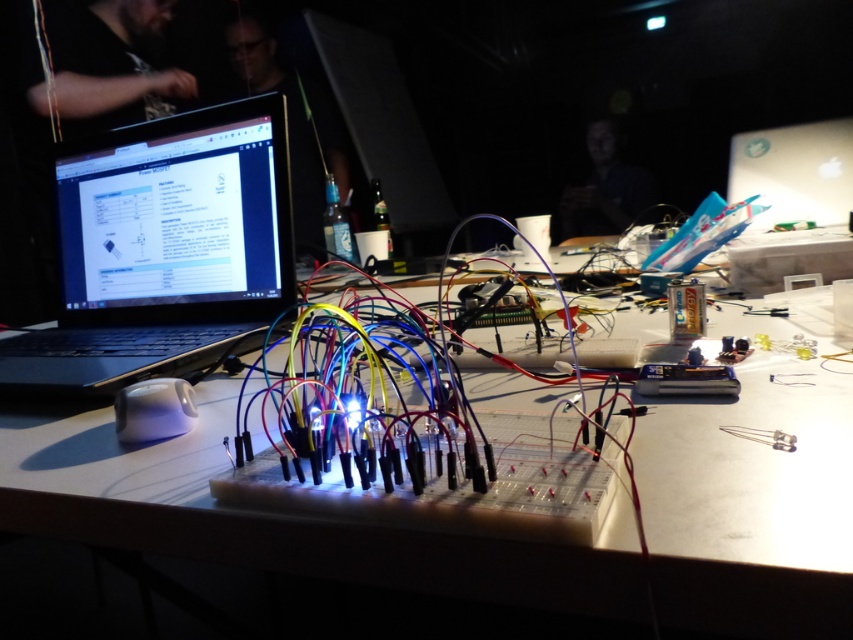
Can you confirm if white plastic table at center is shorter than black matte laptop at left?

Yes, white plastic table at center is shorter than black matte laptop at left.

This screenshot has width=853, height=640. Describe the element at coordinates (277, 516) in the screenshot. I see `white plastic table at center` at that location.

Find the location of a particular element. white plastic table at center is located at coordinates (277, 516).